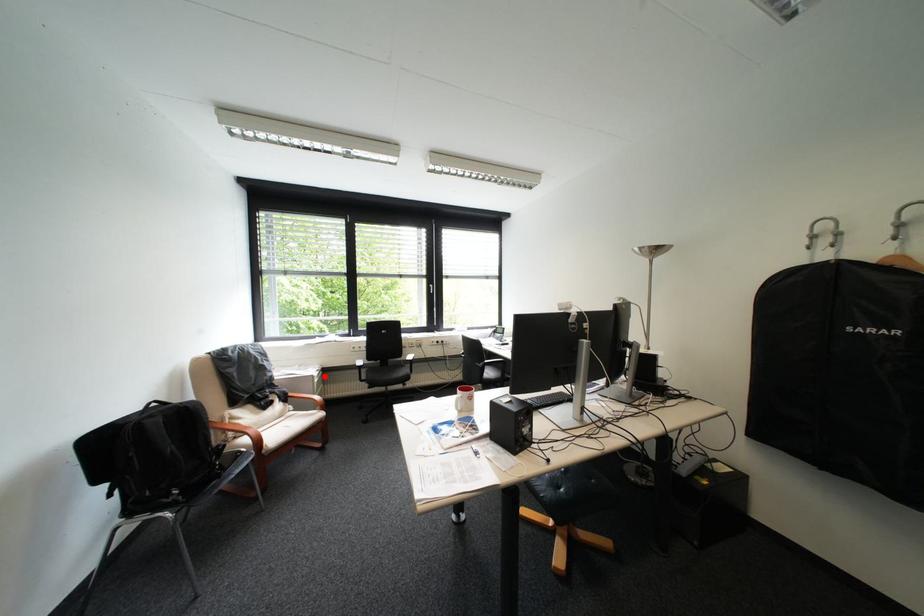
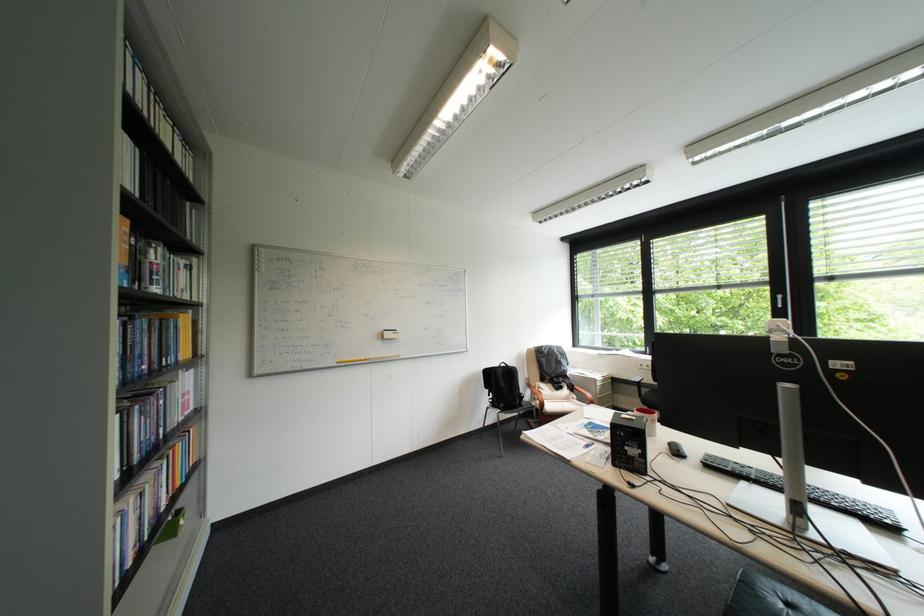
Find the pixel in the second image that matches the highlighted location in the first image.

(608, 379)